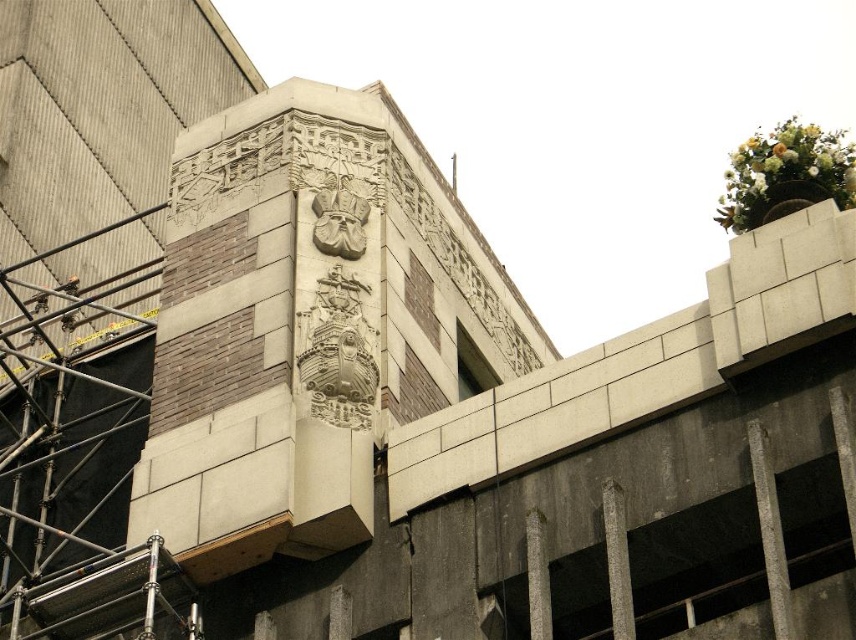
Who is taller, gray stone pillar at center or smooth concrete pillar at center?

gray stone pillar at center

Does gray stone pillar at center have a greater width compared to smooth concrete pillar at center?

Correct, the width of gray stone pillar at center exceeds that of smooth concrete pillar at center.

Between point (607, 516) and point (550, 627), which one is positioned in front?

Positioned in front is point (550, 627).

Image resolution: width=856 pixels, height=640 pixels. I want to click on gray stone pillar at center, so click(617, 561).

Between white floral bouquet at upper right and gray stone pillar at center, which one has less height?

Standing shorter between the two is gray stone pillar at center.

Between white floral bouquet at upper right and gray stone pillar at center, which one is positioned lower?

gray stone pillar at center is below.

Which is in front, point (752, 141) or point (608, 556)?

Positioned in front is point (608, 556).

Identify the location of white floral bouquet at upper right. (785, 173).

Where is `white floral bouquet at upper right`? The height and width of the screenshot is (640, 856). white floral bouquet at upper right is located at coordinates (785, 173).

What do you see at coordinates (785, 173) in the screenshot? I see `white floral bouquet at upper right` at bounding box center [785, 173].

You are a GUI agent. You are given a task and a screenshot of the screen. Output one action in this format:
    pyautogui.click(x=<x>, y=<y>)
    Task: Click on the white floral bouquet at upper right
    
    Given the screenshot: What is the action you would take?
    [785, 173]